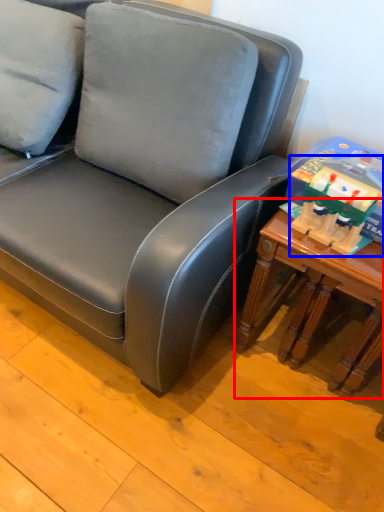
Question: Which object is further to the camera taking this photo, table (highlighted by a red box) or toy (highlighted by a blue box)?

Choices:
 (A) table
 (B) toy

Answer: (A)